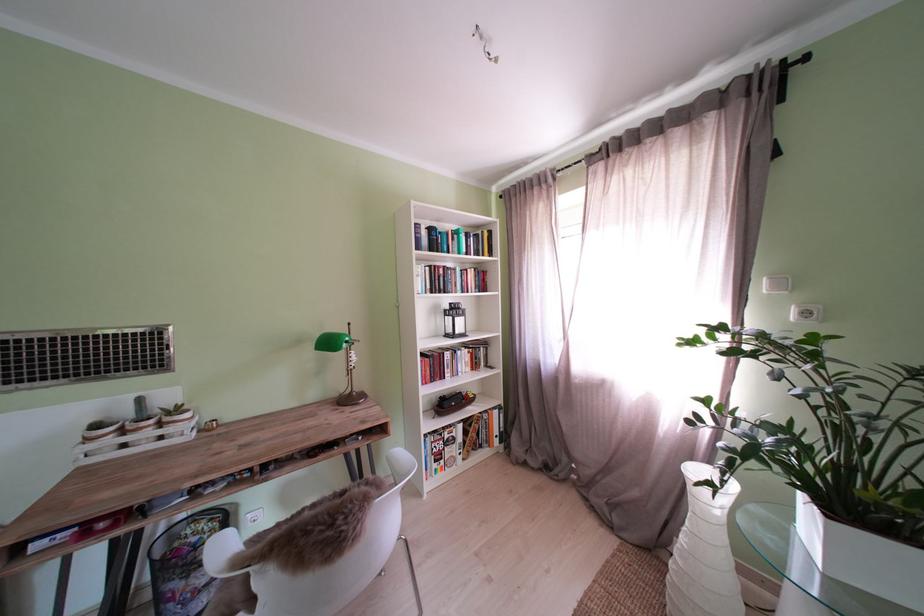
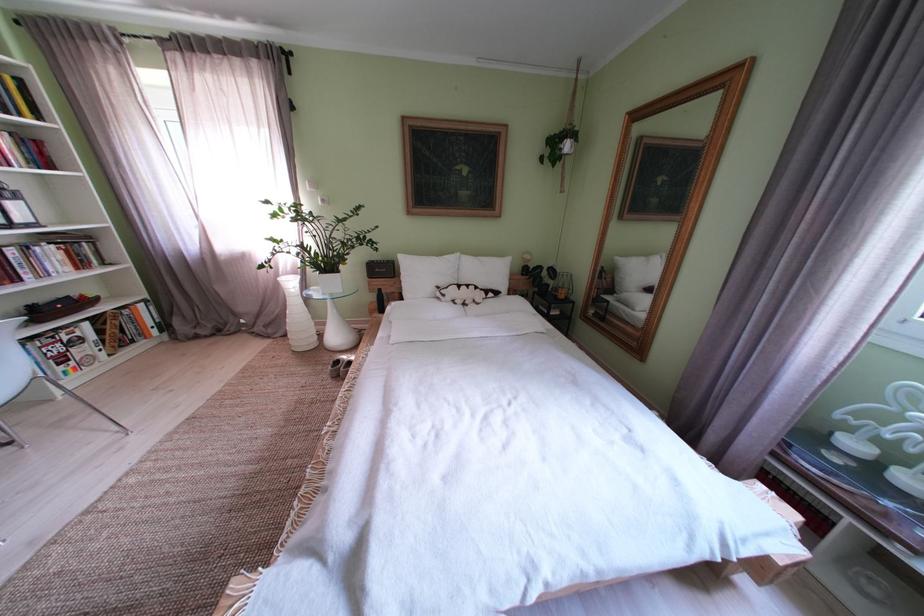
Locate, in the second image, the point that corresponds to the point at 491,245 in the first image.

(9, 92)